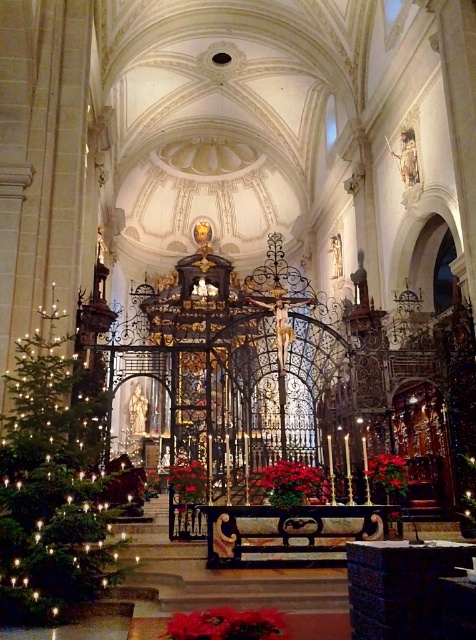
Looking at this image, what are the coordinates of the green matte christmas tree at left in the church scene?

The green matte christmas tree at left is located at coordinates point (51, 484).

From the picture: You are planning to decorate a living room and want to place the green matte christmas tree at left and the red velvet poinsettia at lower center. Based on their sizes, which one should be placed in a spot where height is a concern?

The green matte christmas tree at left is taller than the red velvet poinsettia at lower center, so the red velvet poinsettia at lower center should be placed in the spot where height is a concern since it is shorter.